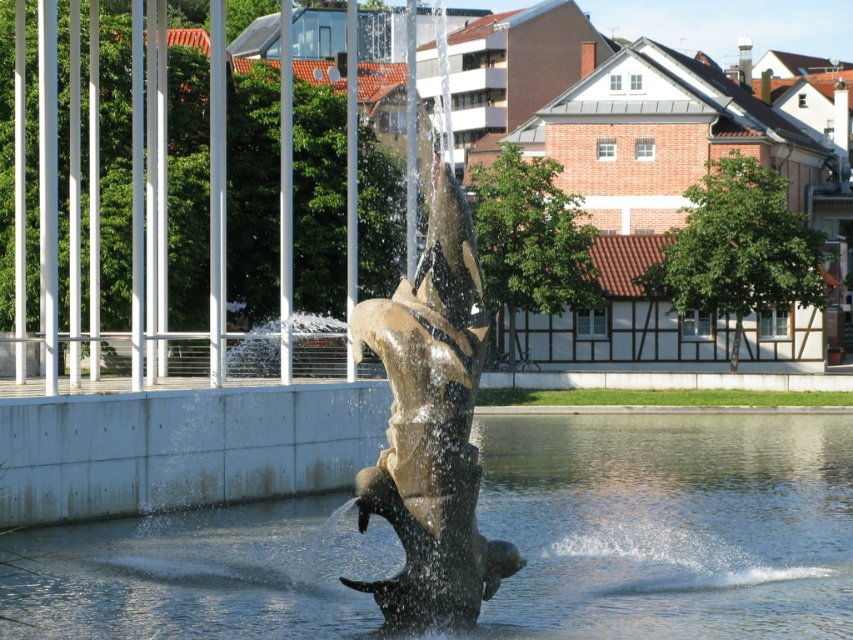
You are a park visitor who wants to take a photo of the gold polished metal fish at center and the clear water at center. Where should you position yourself to ensure both are visible in the frame?

You should position yourself so that the gold polished metal fish at center is above the clear water at center in the frame, as the clear water at center is located below the gold polished metal fish at center according to the description.

You are an urban planner assessing the fountain sculpture in the park. You need to determine if the clear water at center can accommodate the gold polished metal fish at center without overcrowding. Based on their sizes, what is your recommendation?

The clear water at center is wider than the gold polished metal fish at center. Since the water area is wider, the gold polished metal fish at center can be placed there without overcrowding.

You are standing at point (669, 524) in the park. What do you see around you?

You are standing at point (669, 524) where clear water at center is located.